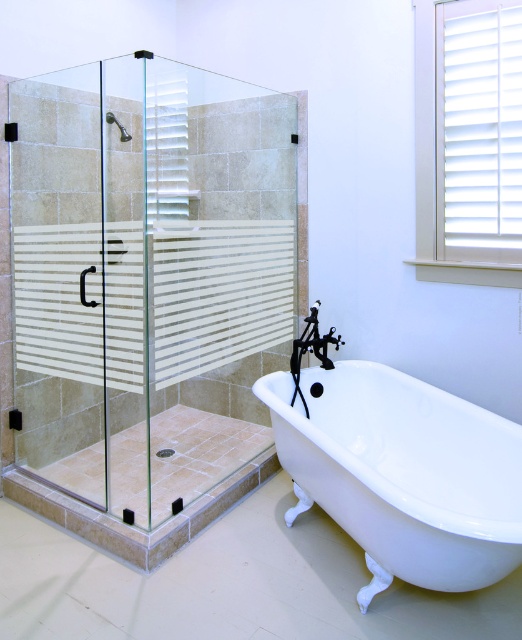
Question: Considering the relative positions of clear glass shower door at left and white glossy bathtub at lower right in the image provided, where is clear glass shower door at left located with respect to white glossy bathtub at lower right?

Choices:
 (A) above
 (B) below

Answer: (A)

Question: Which of the following is the closest to the observer?

Choices:
 (A) [230, 388]
 (B) [386, 458]

Answer: (B)

Question: Which point is closer to the camera?

Choices:
 (A) (346, 419)
 (B) (51, 356)
 (C) (123, 132)

Answer: (A)

Question: Is white glossy bathtub at lower right positioned in front of matte silver handle at upper left?

Choices:
 (A) yes
 (B) no

Answer: (A)

Question: Considering the real-world distances, which object is closest to the clear glass shower door at left?

Choices:
 (A) white glossy bathtub at lower right
 (B) matte silver handle at upper left

Answer: (B)

Question: Does clear glass shower door at left have a lesser width compared to matte silver handle at upper left?

Choices:
 (A) yes
 (B) no

Answer: (B)